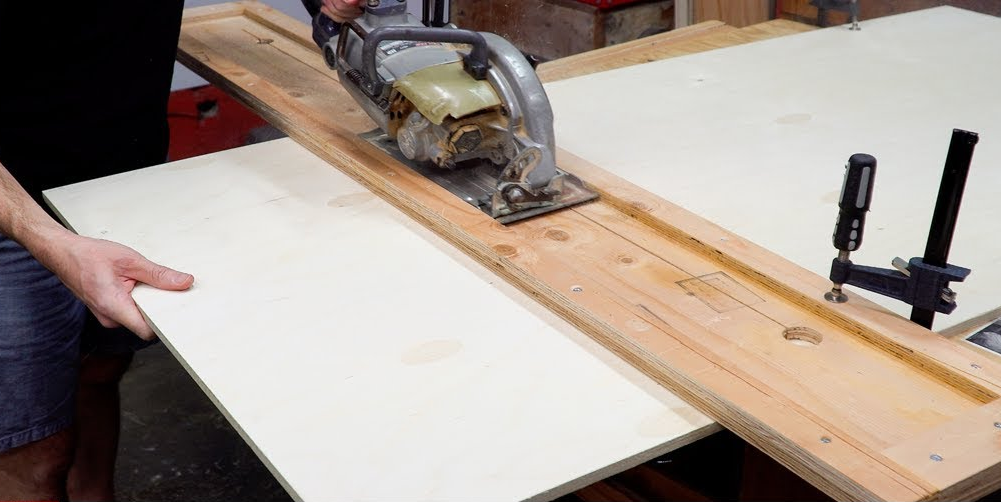
At what (x,y) coordinates should I click in order to perform the action: click on wooden panel. Please return your answer as a coordinate pair (x, y). The image size is (1001, 502). Looking at the image, I should click on (678, 288).